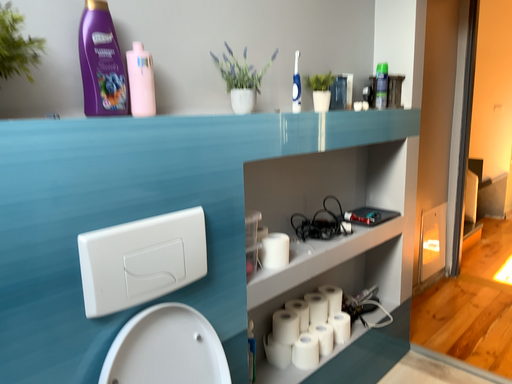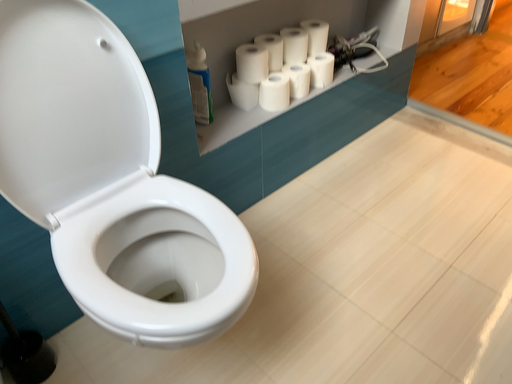
Question: Which way did the camera rotate in the video?

Choices:
 (A) rotated downward
 (B) rotated upward

Answer: (A)